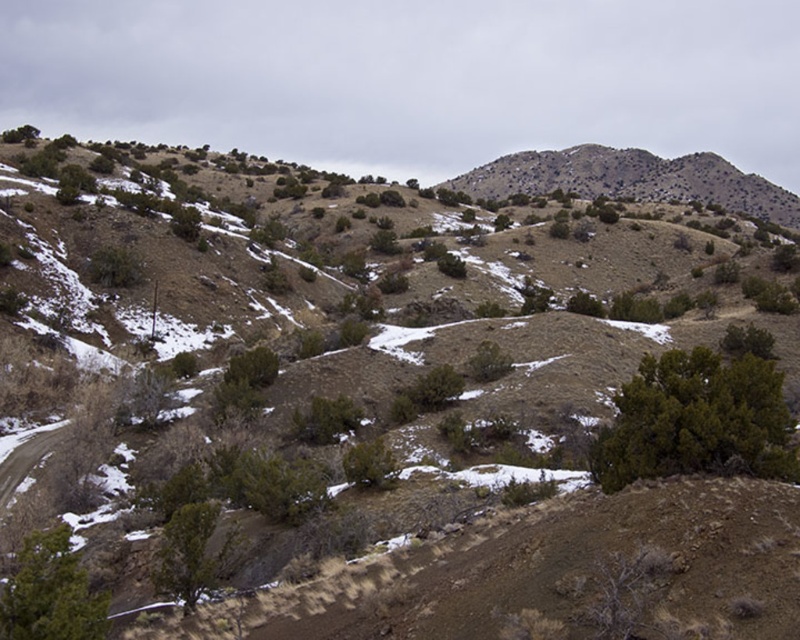
Is desert brown hill at upper right positioned at the back of green matte tree at lower left?

Yes, desert brown hill at upper right is further from the viewer.

Is point (758, 214) closer to camera compared to point (36, 636)?

No, (758, 214) is behind (36, 636).

Who is more forward, (536, 163) or (12, 598)?

Point (12, 598) is in front.

At what (x,y) coordinates should I click in order to perform the action: click on desert brown hill at upper right. Please return your answer as a coordinate pair (x, y). Looking at the image, I should click on (632, 179).

Who is higher up, green matte tree at lower left or green leafy shrub at lower left?

Positioned higher is green leafy shrub at lower left.

At what (x,y) coordinates should I click in order to perform the action: click on green matte tree at lower left. Please return your answer as a coordinate pair (x, y). The width and height of the screenshot is (800, 640). Looking at the image, I should click on (50, 593).

At what (x,y) coordinates should I click in order to perform the action: click on green matte tree at lower left. Please return your answer as a coordinate pair (x, y). The width and height of the screenshot is (800, 640). Looking at the image, I should click on (50, 593).

Is point (718, 401) positioned in front of point (174, 557)?

Yes, it is in front of point (174, 557).

Is point (734, 449) farther from camera compared to point (178, 512)?

No.

Identify the location of green leafy bush at lower right. (696, 420).